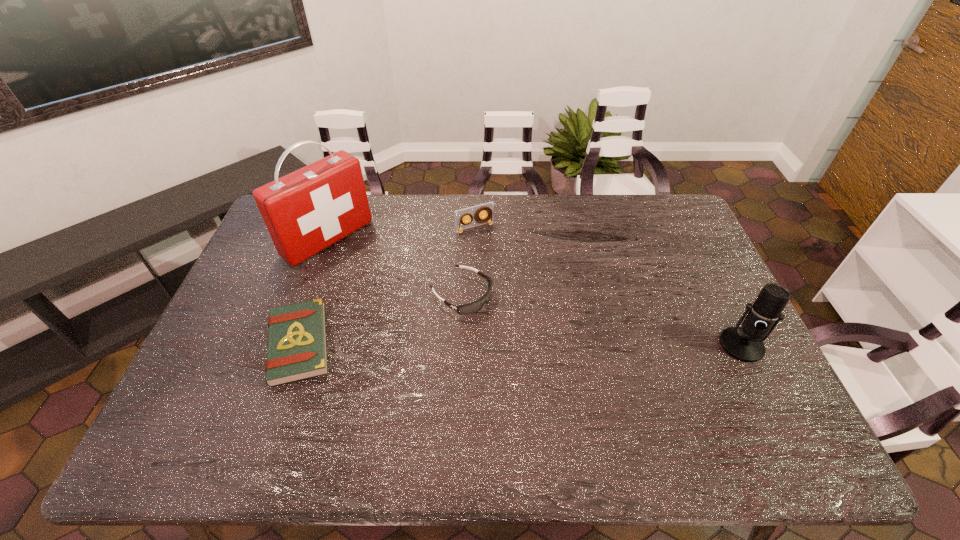
Where is `free space that is in between the goggles and the second tallest object`? The width and height of the screenshot is (960, 540). free space that is in between the goggles and the second tallest object is located at coordinates (602, 320).

In order to click on object identified as the second closest to the tallest object in this screenshot , I will do `click(465, 309)`.

Choose which object is the second nearest neighbor to the goggles. Please provide its 2D coordinates. Your answer should be formatted as a tuple, i.e. [(x, y)], where the tuple contains the x and y coordinates of a point satisfying the conditions above.

[(306, 211)]

Where is `vacant space that satisfies the following two spatial constraints: 1. on the front side of the rightmost object; 2. on the left side of the shortest object`? This screenshot has height=540, width=960. vacant space that satisfies the following two spatial constraints: 1. on the front side of the rightmost object; 2. on the left side of the shortest object is located at coordinates (299, 345).

What are the coordinates of `free location that satisfies the following two spatial constraints: 1. on the front side of the goggles; 2. on the left side of the first-aid kit` in the screenshot? It's located at (308, 294).

Find the location of a particular element. The width and height of the screenshot is (960, 540). vacant space that satisfies the following two spatial constraints: 1. on the back side of the videotape; 2. on the left side of the goggles is located at coordinates pos(464,228).

Where is `free space that satisfies the following two spatial constraints: 1. on the front side of the fourth shortest object; 2. on the left side of the first-aid kit`? The image size is (960, 540). free space that satisfies the following two spatial constraints: 1. on the front side of the fourth shortest object; 2. on the left side of the first-aid kit is located at coordinates (290, 345).